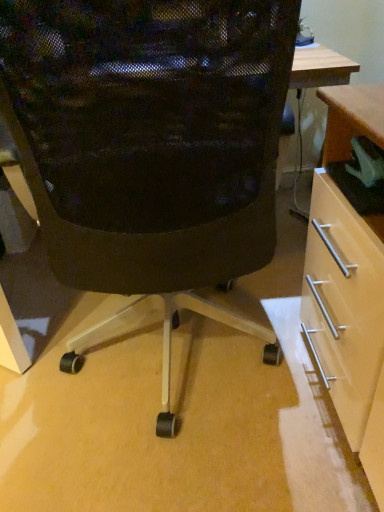
This screenshot has width=384, height=512. What are the coordinates of `free point below black mesh chair at center (from a real-world perspective)` in the screenshot? It's located at (173, 389).